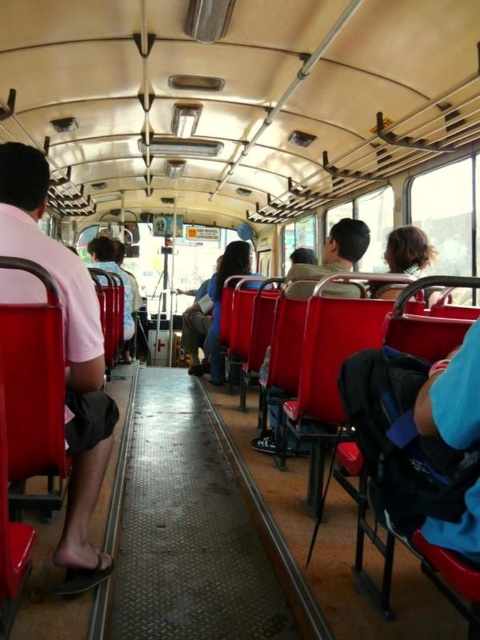
You are a passenger standing on the public bus and see a pink cotton shirt at left and a matte red seat at center. Which object is closer to the floor?

The pink cotton shirt at left is below the matte red seat at center, so it is closer to the floor.

You are a passenger on a vintage public bus and notice two items in the scene. One is a pink cotton shirt at left and the other is a matte red seat at center. Which item takes up more space in the image?

The matte red seat at center takes up more space in the image because the pink cotton shirt at left is smaller than it.

Consider the image. You are standing on the public bus and want to move from the pink cotton shirt at left to the matte red seat at center. Is there enough space between them for you to walk through comfortably?

The pink cotton shirt at left and matte red seat at center are 5.83 feet apart from each other, which provides sufficient space for a person to walk through comfortably.